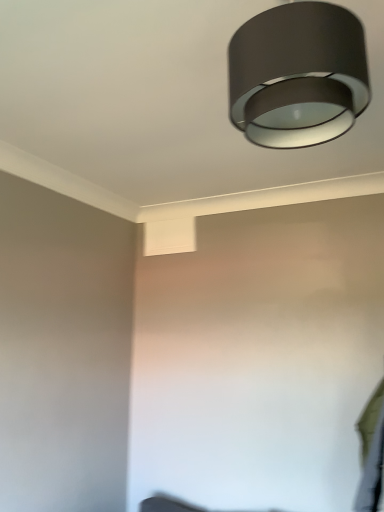
Measure the distance between matte gray lampshade at upper center and camera.

matte gray lampshade at upper center and camera are 29.49 inches apart from each other.

I want to click on matte gray lampshade at upper center, so click(298, 75).

What do you see at coordinates (298, 75) in the screenshot? I see `matte gray lampshade at upper center` at bounding box center [298, 75].

The width and height of the screenshot is (384, 512). In order to click on matte gray lampshade at upper center in this screenshot , I will do `click(298, 75)`.